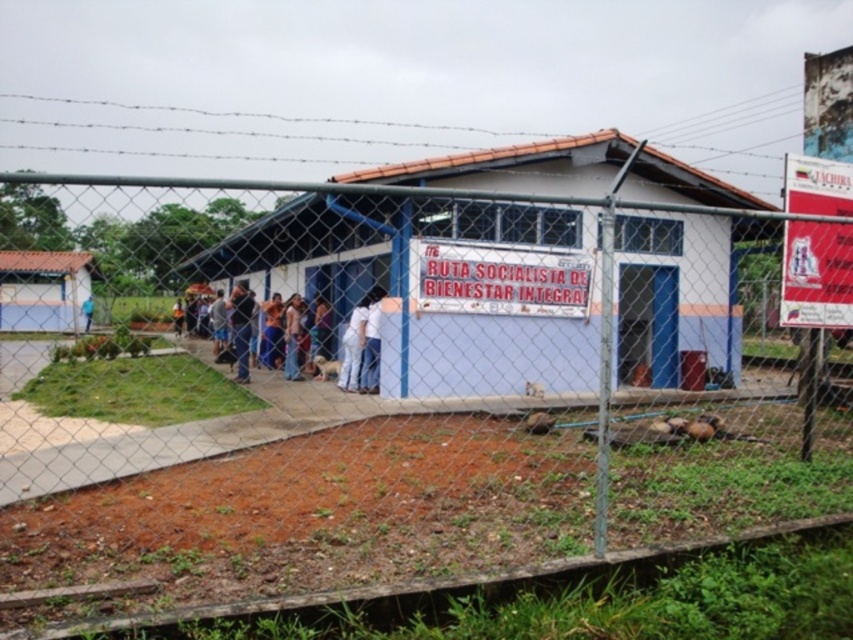
Question: Is white painted wood hut at center thinner than matte white hut at left?

Choices:
 (A) no
 (B) yes

Answer: (A)

Question: Which object appears closest to the camera in this image?

Choices:
 (A) matte white hut at left
 (B) white cotton shirt at center
 (C) blue fabric shirt at left

Answer: (B)

Question: Can you confirm if matte white hut at left is positioned to the left of blue fabric shirt at left?

Choices:
 (A) no
 (B) yes

Answer: (B)

Question: Which object is the closest to the white cotton shirt at center?

Choices:
 (A) white painted wood hut at center
 (B) matte white hut at left
 (C) blue fabric shirt at left

Answer: (A)

Question: Which object is farther from the camera taking this photo?

Choices:
 (A) blue fabric shirt at left
 (B) matte white hut at left
 (C) white painted wood hut at center
 (D) white cotton shirt at center

Answer: (B)

Question: Does white painted wood hut at center have a larger size compared to blue fabric shirt at left?

Choices:
 (A) yes
 (B) no

Answer: (A)